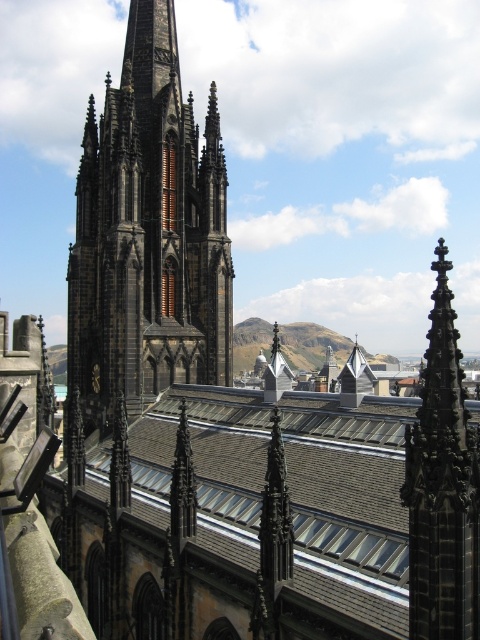
From the picture: You are standing in front of the grand Gothic cathedral and want to locate the brown tile roof at center. Based on its coordinates, where would you look relative to the central spire?

The brown tile roof at center is located at coordinates point (250,516), which is to the right and slightly below the central spire.

You are standing in front of the grand Gothic church. You see a point marked at coordinates (250,516). What is located at this point?

The point at coordinates (250,516) marks the brown tile roof at center.

You are standing in front of the Gothic cathedral and want to take a photo of the brown tile roof at center and the dark gray stone tower at center. Which object will appear larger in your photo?

The brown tile roof at center will appear larger in the photo because it is closer to the viewer than the dark gray stone tower at center.